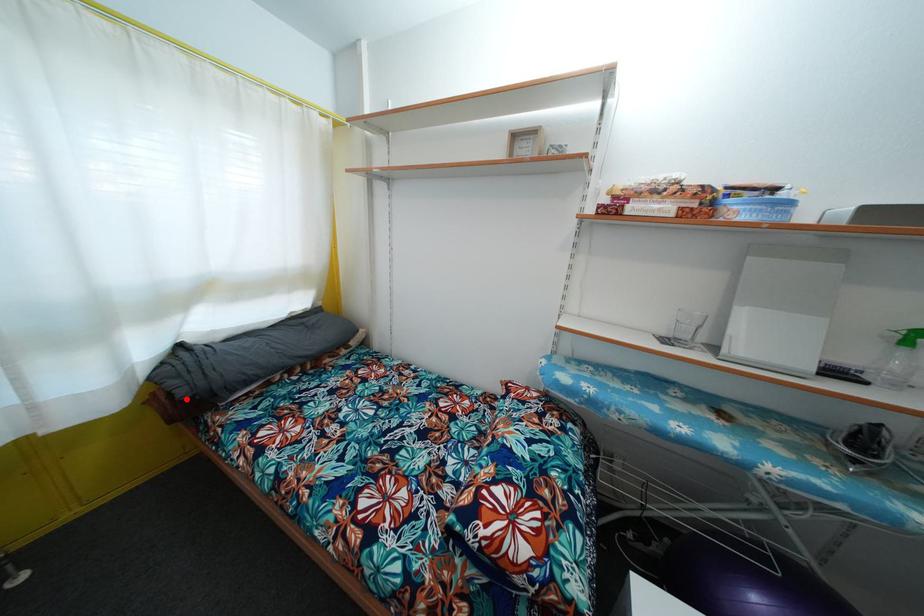
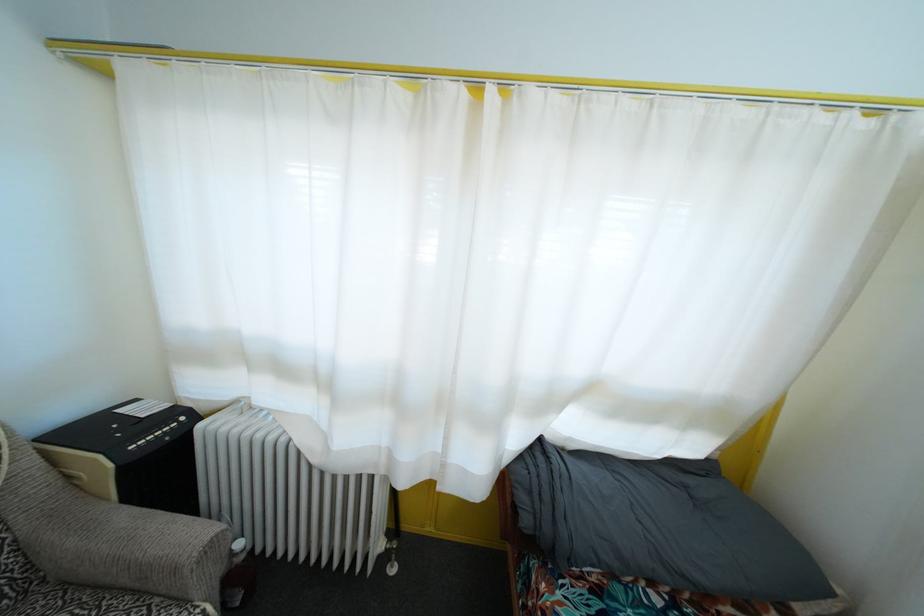
Question: I am providing you with two images of the same scene from different viewpoints. Image1 has a red point marked. In image2, the corresponding 3D location appears at what relative position? Reply with the corresponding letter.

Choices:
 (A) Closer
 (B) Farther

Answer: (B)